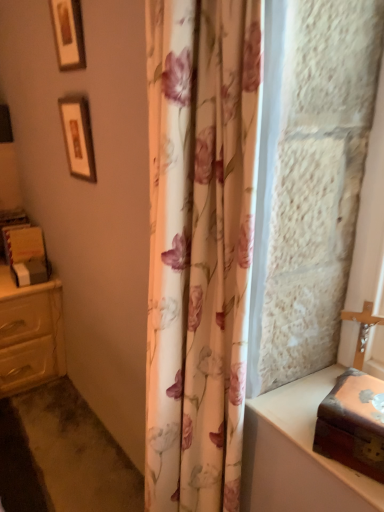
The image size is (384, 512). What do you see at coordinates (298, 455) in the screenshot?
I see `wooden box at right` at bounding box center [298, 455].

Measure the distance between wooden box at right and camera.

wooden box at right and camera are 28.82 inches apart from each other.

The image size is (384, 512). What do you see at coordinates (199, 246) in the screenshot?
I see `floral fabric shower curtain at center` at bounding box center [199, 246].

This screenshot has height=512, width=384. What do you see at coordinates (30, 334) in the screenshot? I see `matte cream chest of drawers at left` at bounding box center [30, 334].

This screenshot has width=384, height=512. In order to click on wooden box at right in this screenshot , I will do pyautogui.click(x=351, y=426).

The height and width of the screenshot is (512, 384). In order to click on wooden box at right in this screenshot , I will do `click(298, 455)`.

From the picture: Which object is positioned more to the right, matte cream chest of drawers at left or wooden framed picture at upper left, marked as the 1th picture frame in a bottom-to-top arrangement?

From the viewer's perspective, wooden framed picture at upper left, marked as the 1th picture frame in a bottom-to-top arrangement, appears more on the right side.

How distant is matte cream chest of drawers at left from wooden framed picture at upper left, marked as the 1th picture frame in a bottom-to-top arrangement?

The distance of matte cream chest of drawers at left from wooden framed picture at upper left, marked as the 1th picture frame in a bottom-to-top arrangement, is 31.79 inches.

From the image's perspective, is matte cream chest of drawers at left above or below wooden framed picture at upper left, the second picture frame in the top-to-bottom sequence?

matte cream chest of drawers at left is below wooden framed picture at upper left, the second picture frame in the top-to-bottom sequence.

Which picture frame is the 1st one when counting from the front of the matte cream chest of drawers at left? Please provide its 2D coordinates.

[(78, 137)]

Is floral fabric shower curtain at center taller or shorter than matte cream chest of drawers at left?

Considering their sizes, floral fabric shower curtain at center has more height than matte cream chest of drawers at left.

Considering the relative sizes of floral fabric shower curtain at center and matte cream chest of drawers at left in the image provided, is floral fabric shower curtain at center wider than matte cream chest of drawers at left?

No, floral fabric shower curtain at center is not wider than matte cream chest of drawers at left.

Which point is more distant from viewer, (181, 339) or (10, 288)?

Positioned behind is point (10, 288).

Based on the photo, measure the distance between floral fabric shower curtain at center and matte cream chest of drawers at left.

A distance of 1.19 meters exists between floral fabric shower curtain at center and matte cream chest of drawers at left.

Does wooden box at right contain floral fabric shower curtain at center?

Actually, floral fabric shower curtain at center is outside wooden box at right.

From the image's perspective, relative to floral fabric shower curtain at center, is wooden box at right above or below?

Based on their image positions, wooden box at right is located beneath floral fabric shower curtain at center.

Does wooden box at right have a greater width compared to floral fabric shower curtain at center?

In fact, wooden box at right might be narrower than floral fabric shower curtain at center.

From a real-world perspective, which is physically above, wooden box at right or floral fabric shower curtain at center?

floral fabric shower curtain at center.

Relative to wooden box at right, is matte cream chest of drawers at left in front or behind?

matte cream chest of drawers at left is behind wooden box at right.

From the image's perspective, would you say matte cream chest of drawers at left is positioned over wooden box at right?

Yes.

From a real-world perspective, is matte cream chest of drawers at left located beneath wooden box at right?

Yes, from a real-world perspective, matte cream chest of drawers at left is under wooden box at right.

Considering the points (168, 339) and (374, 384), which point is behind, point (168, 339) or point (374, 384)?

The point (168, 339) is farther from the camera.

Which of these two, floral fabric shower curtain at center or wooden box at right, stands taller?

With more height is floral fabric shower curtain at center.

Does floral fabric shower curtain at center touch wooden box at right?

floral fabric shower curtain at center and wooden box at right are not in contact.

From the image's perspective, which one is positioned higher, floral fabric shower curtain at center or wooden box at right?

floral fabric shower curtain at center appears higher in the image.

At what (x,y) coordinates should I click in order to perform the action: click on box on the right of wooden framed picture at upper left, marked as the 1th picture frame in a bottom-to-top arrangement. Please return your answer as a coordinate pair (x, y). Looking at the image, I should click on (351, 426).

Is wooden framed picture at upper left, marked as the 1th picture frame in a bottom-to-top arrangement, far from wooden box at right?

Indeed, wooden framed picture at upper left, marked as the 1th picture frame in a bottom-to-top arrangement, is not near wooden box at right.

Is wooden framed picture at upper left, the second picture frame in the top-to-bottom sequence, looking in the opposite direction of wooden box at right?

That's not correct — wooden framed picture at upper left, the second picture frame in the top-to-bottom sequence, is not looking away from wooden box at right.

In the image, is wooden framed picture at upper left, the second picture frame in the top-to-bottom sequence, on the left side or the right side of wooden box at right?

In the image, wooden framed picture at upper left, the second picture frame in the top-to-bottom sequence, appears on the left side of wooden box at right.

Starting from the wooden box at right, which picture frame is the 2nd one behind? Please provide its 2D coordinates.

[(78, 137)]

Which is in front, point (326, 390) or point (78, 137)?

The point (326, 390) is closer.

From the picture: How distant is wooden box at right from wooden framed picture at upper left, marked as the 1th picture frame in a bottom-to-top arrangement?

→ wooden box at right is 1.04 meters from wooden framed picture at upper left, marked as the 1th picture frame in a bottom-to-top arrangement.

Is wooden box at right smaller than wooden framed picture at upper left, marked as the 1th picture frame in a bottom-to-top arrangement?

Yes.

You are a GUI agent. You are given a task and a screenshot of the screen. Output one action in this format:
    pyautogui.click(x=<x>, y=<y>)
    Task: Click on the 1st picture frame in front of the matte cream chest of drawers at left, starting your count from the anchor
    Image resolution: width=384 pixels, height=512 pixels.
    Given the screenshot: What is the action you would take?
    pyautogui.click(x=78, y=137)

Image resolution: width=384 pixels, height=512 pixels. Identify the location of shower curtain that is above the matte cream chest of drawers at left (from the image's perspective). (199, 246).

From the image, which object appears to be nearer to wooden box at right, wooden framed picture at upper left, which is counted as the first picture frame, starting from the top, or wooden framed picture at upper left, the second picture frame in the top-to-bottom sequence?

The object closer to wooden box at right is wooden framed picture at upper left, the second picture frame in the top-to-bottom sequence.

When comparing their distances from floral fabric shower curtain at center, does wooden framed picture at upper left, marked as the 2th picture frame in a bottom-to-top arrangement, or wooden box at right seem closer?

wooden box at right is closer to floral fabric shower curtain at center.

From the image, which object appears to be nearer to floral fabric shower curtain at center, wooden box at right or matte cream chest of drawers at left?

Among the two, wooden box at right is located nearer to floral fabric shower curtain at center.

Based on their spatial positions, is wooden framed picture at upper left, marked as the 1th picture frame in a bottom-to-top arrangement, or matte cream chest of drawers at left further from wooden box at right?

The object further to wooden box at right is matte cream chest of drawers at left.

Based on their spatial positions, is wooden framed picture at upper left, which is counted as the first picture frame, starting from the top, or matte cream chest of drawers at left further from wooden framed picture at upper left, marked as the 1th picture frame in a bottom-to-top arrangement?

matte cream chest of drawers at left lies further to wooden framed picture at upper left, marked as the 1th picture frame in a bottom-to-top arrangement, than the other object.

When comparing their distances from floral fabric shower curtain at center, does wooden framed picture at upper left, marked as the 1th picture frame in a bottom-to-top arrangement, or wooden framed picture at upper left, marked as the 2th picture frame in a bottom-to-top arrangement, seem further?

Among the two, wooden framed picture at upper left, marked as the 2th picture frame in a bottom-to-top arrangement, is located further to floral fabric shower curtain at center.

Consider the image. Considering their positions, is matte cream chest of drawers at left positioned closer to wooden box at right than floral fabric shower curtain at center?

Based on the image, floral fabric shower curtain at center appears to be nearer to wooden box at right.

From the image, which object appears to be nearer to wooden box at right, matte cream chest of drawers at left or wooden box at right?

wooden box at right lies closer to wooden box at right than the other object.

Find the location of a particular element. box between floral fabric shower curtain at center and wooden framed picture at upper left, marked as the 1th picture frame in a bottom-to-top arrangement, along the z-axis is located at coordinates (351, 426).

The height and width of the screenshot is (512, 384). Identify the location of vanity situated between floral fabric shower curtain at center and wooden box at right from left to right. (298, 455).

Where is `vanity between floral fabric shower curtain at center and matte cream chest of drawers at left in the front-back direction`? vanity between floral fabric shower curtain at center and matte cream chest of drawers at left in the front-back direction is located at coordinates (298, 455).

Where is `vanity located between floral fabric shower curtain at center and wooden framed picture at upper left, marked as the 1th picture frame in a bottom-to-top arrangement, in the depth direction`? The image size is (384, 512). vanity located between floral fabric shower curtain at center and wooden framed picture at upper left, marked as the 1th picture frame in a bottom-to-top arrangement, in the depth direction is located at coordinates (298, 455).